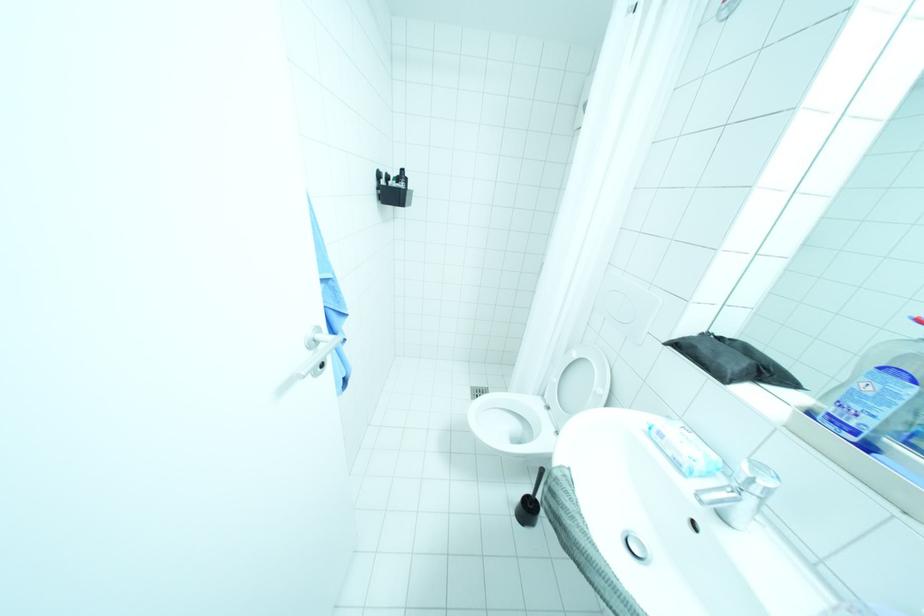
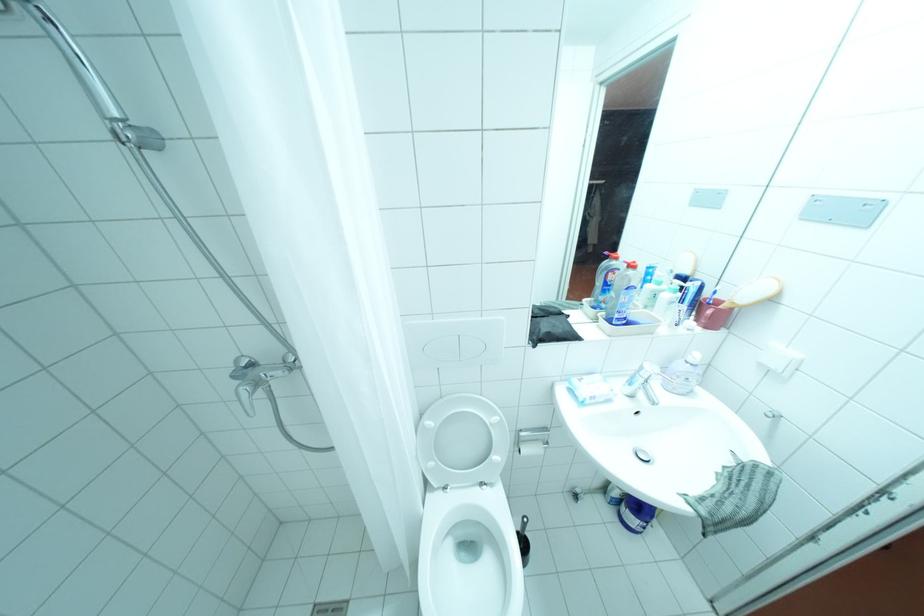
Find the pixel in the second image that matches [556,407] in the first image.

(455, 487)